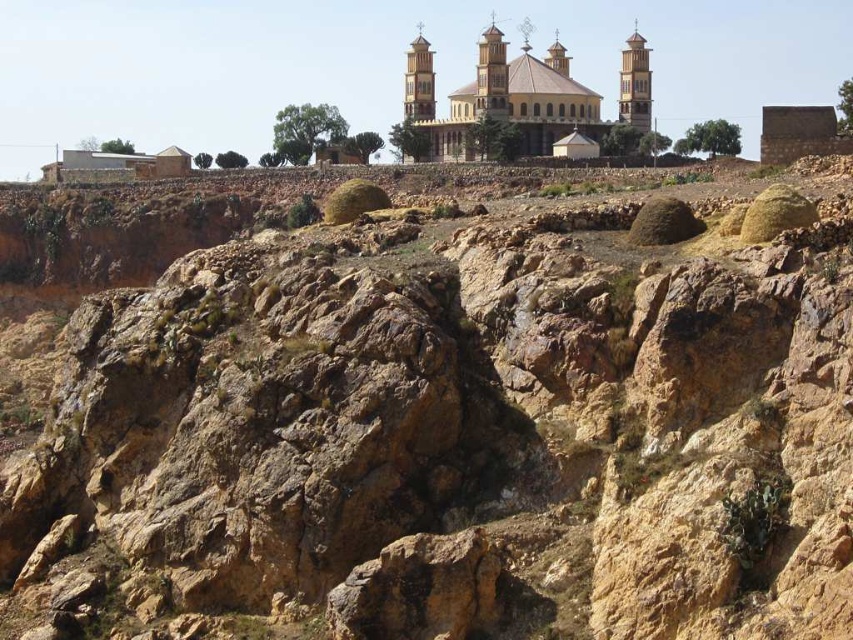
Question: Is golden stone church at upper center wider than wooden tower at upper right?

Choices:
 (A) yes
 (B) no

Answer: (A)

Question: Which of the following is the farthest from the observer?

Choices:
 (A) (634, 109)
 (B) (641, 99)

Answer: (B)

Question: Considering the relative positions of golden stone church at upper center and wooden tower at upper right in the image provided, where is golden stone church at upper center located with respect to wooden tower at upper right?

Choices:
 (A) right
 (B) left

Answer: (B)

Question: Which of the following is the farthest from the observer?

Choices:
 (A) golden stone church at upper center
 (B) wooden tower at upper right

Answer: (B)

Question: Is golden stone church at upper center above wooden tower at upper right?

Choices:
 (A) yes
 (B) no

Answer: (A)